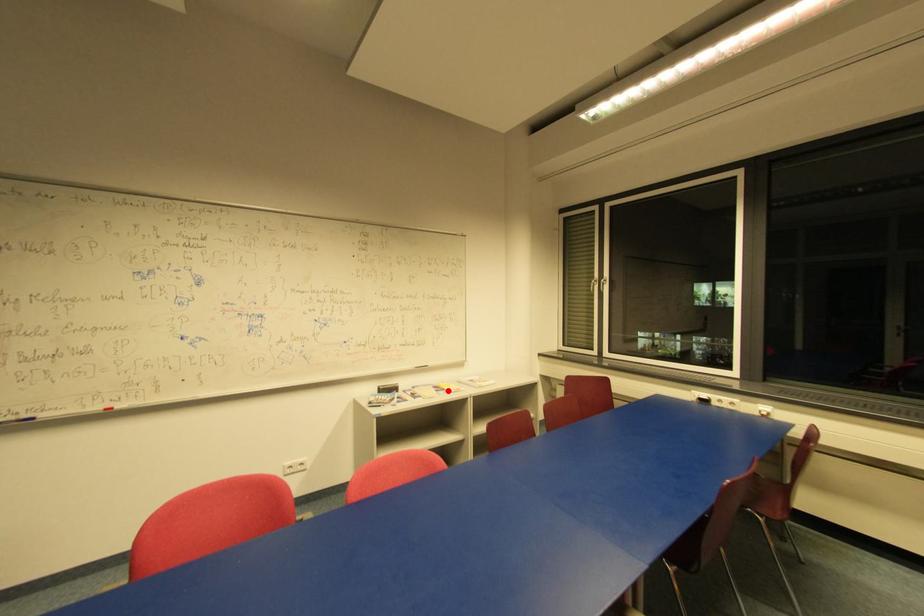
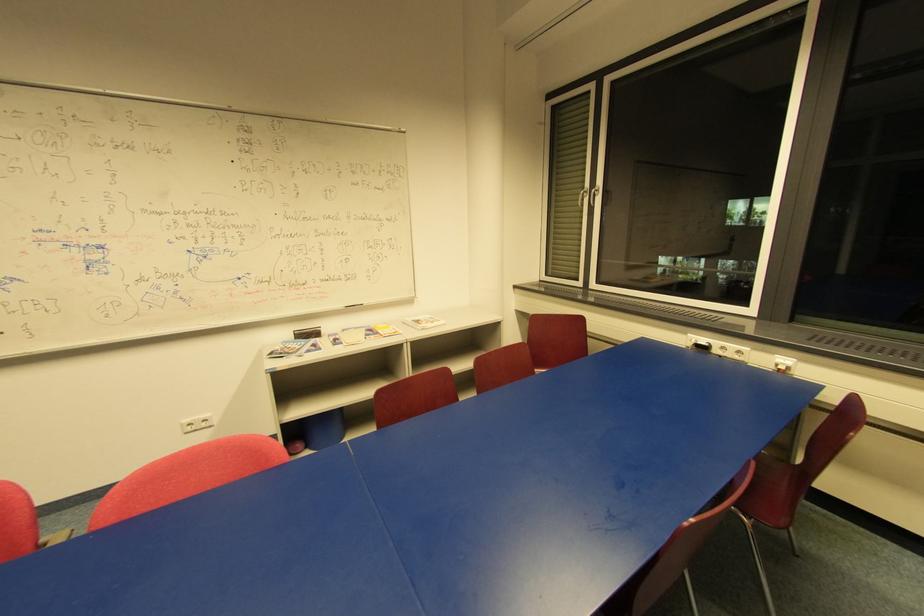
The point at the highlighted location is marked in the first image. Where is the corresponding point in the second image?

(381, 334)